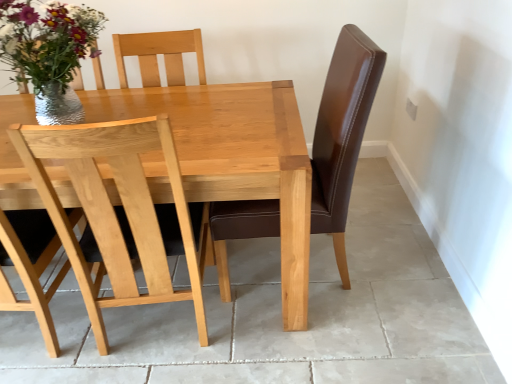
Question: Could you tell me if light wood chair at center is turned towards shiny metallic vase at upper left?

Choices:
 (A) yes
 (B) no

Answer: (B)

Question: Considering the relative positions of light wood chair at center and shiny metallic vase at upper left in the image provided, is light wood chair at center to the left of shiny metallic vase at upper left from the viewer's perspective?

Choices:
 (A) yes
 (B) no

Answer: (B)

Question: Is shiny metallic vase at upper left at the back of light wood chair at center?

Choices:
 (A) no
 (B) yes

Answer: (A)

Question: Is light wood chair at center positioned in front of shiny metallic vase at upper left?

Choices:
 (A) no
 (B) yes

Answer: (B)

Question: Is there a large distance between light wood chair at center and shiny metallic vase at upper left?

Choices:
 (A) yes
 (B) no

Answer: (B)

Question: From a real-world perspective, does light wood chair at center sit lower than shiny metallic vase at upper left?

Choices:
 (A) yes
 (B) no

Answer: (A)

Question: Is light wood chair at center at the back of shiny metallic vase at upper left?

Choices:
 (A) yes
 (B) no

Answer: (B)

Question: Are shiny metallic vase at upper left and light wood chair at center far apart?

Choices:
 (A) no
 (B) yes

Answer: (A)

Question: Is shiny metallic vase at upper left thinner than light wood chair at center?

Choices:
 (A) yes
 (B) no

Answer: (A)

Question: Is shiny metallic vase at upper left smaller than light wood chair at center?

Choices:
 (A) no
 (B) yes

Answer: (B)

Question: Does shiny metallic vase at upper left have a larger size compared to light wood chair at center?

Choices:
 (A) yes
 (B) no

Answer: (B)

Question: Is shiny metallic vase at upper left at the left side of light wood chair at center?

Choices:
 (A) no
 (B) yes

Answer: (B)

Question: Based on their sizes in the image, would you say light wood chair at center is bigger or smaller than shiny metallic vase at upper left?

Choices:
 (A) big
 (B) small

Answer: (A)